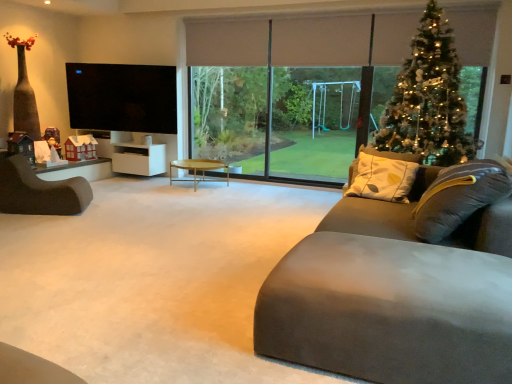
Identify the location of empty space that is ontop of suede-like gray couch at lower right (from a real-world perspective). (395, 255).